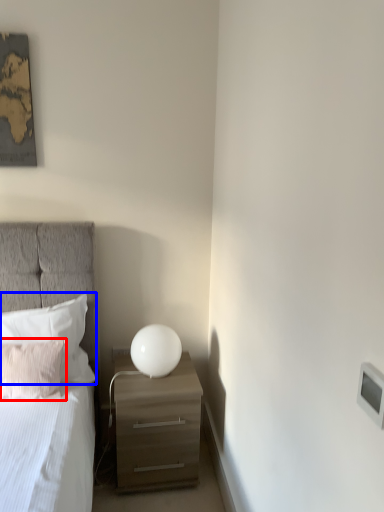
Question: Which of the following is the farthest to the observer, pillow (highlighted by a red box) or pillow (highlighted by a blue box)?

Choices:
 (A) pillow
 (B) pillow

Answer: (B)